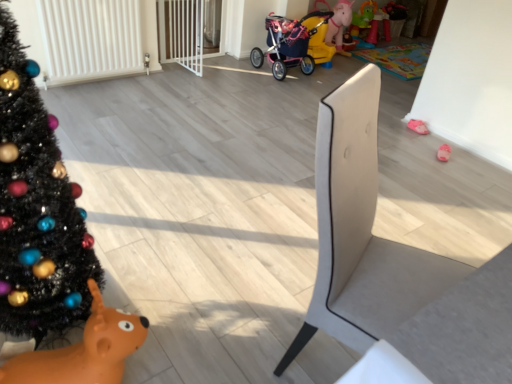
Question: From a real-world perspective, is pink fabric slipper at lower right, marked as the 2th toy in a left-to-right arrangement, on pink fabric baby carriage at center?

Choices:
 (A) yes
 (B) no

Answer: (B)

Question: Does pink fabric slipper at lower right, which appears as the second toy when ordered from the bottom, appear on the right side of pink fabric baby carriage at center?

Choices:
 (A) yes
 (B) no

Answer: (A)

Question: Is pink fabric slipper at lower right, the 1th toy positioned from the right, further to camera compared to pink fabric baby carriage at center?

Choices:
 (A) yes
 (B) no

Answer: (B)

Question: Considering the relative positions of pink fabric slipper at lower right, marked as the 2th toy in a left-to-right arrangement, and pink fabric baby carriage at center in the image provided, is pink fabric slipper at lower right, marked as the 2th toy in a left-to-right arrangement, to the left of pink fabric baby carriage at center from the viewer's perspective?

Choices:
 (A) no
 (B) yes

Answer: (A)

Question: Does pink fabric slipper at lower right, which appears as the second toy when ordered from the bottom, have a larger size compared to pink fabric baby carriage at center?

Choices:
 (A) no
 (B) yes

Answer: (A)

Question: From a real-world perspective, is pink fabric slipper at lower right, the 1th toy positioned from the right, above or below black matte christmas tree at left?

Choices:
 (A) below
 (B) above

Answer: (A)

Question: From the image's perspective, is pink fabric slipper at lower right, the 1th toy positioned from the right, positioned above or below black matte christmas tree at left?

Choices:
 (A) below
 (B) above

Answer: (B)

Question: Is pink fabric slipper at lower right, the 1th toy positioned from the right, inside or outside of black matte christmas tree at left?

Choices:
 (A) inside
 (B) outside

Answer: (B)

Question: Considering the positions of pink fabric slipper at lower right, which appears as the second toy when ordered from the bottom, and black matte christmas tree at left in the image, is pink fabric slipper at lower right, which appears as the second toy when ordered from the bottom, taller or shorter than black matte christmas tree at left?

Choices:
 (A) short
 (B) tall

Answer: (A)

Question: Considering their positions, is pink fabric baby carriage at center located in front of or behind black matte christmas tree at left?

Choices:
 (A) behind
 (B) front

Answer: (A)

Question: Would you say pink fabric baby carriage at center is inside or outside black matte christmas tree at left?

Choices:
 (A) inside
 (B) outside

Answer: (B)

Question: Considering the positions of pink fabric baby carriage at center and black matte christmas tree at left in the image, is pink fabric baby carriage at center taller or shorter than black matte christmas tree at left?

Choices:
 (A) short
 (B) tall

Answer: (A)

Question: From a real-world perspective, is pink fabric baby carriage at center physically located above or below black matte christmas tree at left?

Choices:
 (A) above
 (B) below

Answer: (B)

Question: Is pink fabric slipper at lower right, marked as the 2th toy in a left-to-right arrangement, situated inside orange rubber reindeer at lower left, which ranks as the 1th toy in front-to-back order, or outside?

Choices:
 (A) inside
 (B) outside

Answer: (B)

Question: Considering the positions of point click(425, 132) and point click(84, 354), is point click(425, 132) closer or farther from the camera than point click(84, 354)?

Choices:
 (A) farther
 (B) closer

Answer: (A)